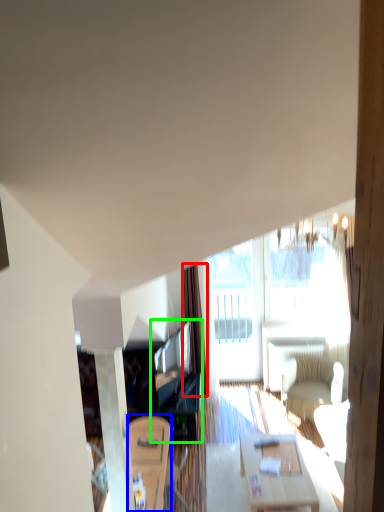
Question: Estimate the real-world distances between objects in this image. Which object is farther from curtain (highlighted by a red box), table (highlighted by a blue box) or entertainment center (highlighted by a green box)?

Choices:
 (A) table
 (B) entertainment center

Answer: (A)